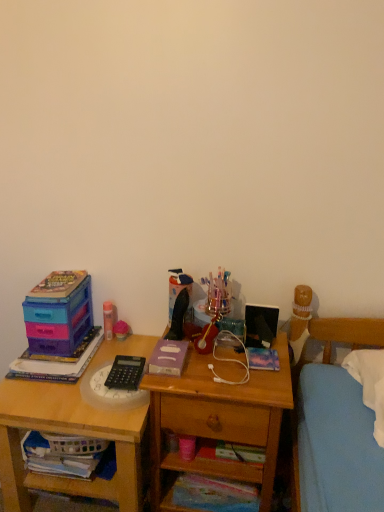
Question: Can you confirm if pink matte glue stick at upper left, which is the second stationery from bottom to top, is wider than matte plastic storage box at left?

Choices:
 (A) no
 (B) yes

Answer: (A)

Question: Is pink matte glue stick at upper left, which is the first stationery from back to front, next to matte plastic storage box at left and touching it?

Choices:
 (A) yes
 (B) no

Answer: (B)

Question: From the image's perspective, does pink matte glue stick at upper left, placed as the 1th stationery when sorted from top to bottom, appear higher than matte plastic storage box at left?

Choices:
 (A) yes
 (B) no

Answer: (B)

Question: Can you confirm if pink matte glue stick at upper left, the 1th stationery viewed from the left, is bigger than matte plastic storage box at left?

Choices:
 (A) no
 (B) yes

Answer: (A)

Question: Does pink matte glue stick at upper left, the 1th stationery viewed from the left, appear on the left side of matte plastic storage box at left?

Choices:
 (A) yes
 (B) no

Answer: (B)

Question: Is pink matte glue stick at upper left, arranged as the second stationery when viewed from the right, turned away from matte plastic storage box at left?

Choices:
 (A) yes
 (B) no

Answer: (B)

Question: Does wooden desk at left come in front of wooden nightstand at center?

Choices:
 (A) no
 (B) yes

Answer: (A)

Question: Considering the relative sizes of wooden desk at left and wooden nightstand at center in the image provided, is wooden desk at left thinner than wooden nightstand at center?

Choices:
 (A) yes
 (B) no

Answer: (B)

Question: Can you confirm if wooden desk at left is shorter than wooden nightstand at center?

Choices:
 (A) yes
 (B) no

Answer: (A)

Question: Can you confirm if wooden desk at left is smaller than wooden nightstand at center?

Choices:
 (A) no
 (B) yes

Answer: (A)

Question: From a real-world perspective, is wooden desk at left on top of wooden nightstand at center?

Choices:
 (A) no
 (B) yes

Answer: (A)

Question: From the image's perspective, does wooden desk at left appear lower than wooden nightstand at center?

Choices:
 (A) yes
 (B) no

Answer: (A)

Question: Considering the relative sizes of matte plastic toy at center and pink matte glue stick at upper left, placed as the 1th stationery when sorted from top to bottom, in the image provided, is matte plastic toy at center smaller than pink matte glue stick at upper left, placed as the 1th stationery when sorted from top to bottom,?

Choices:
 (A) no
 (B) yes

Answer: (B)